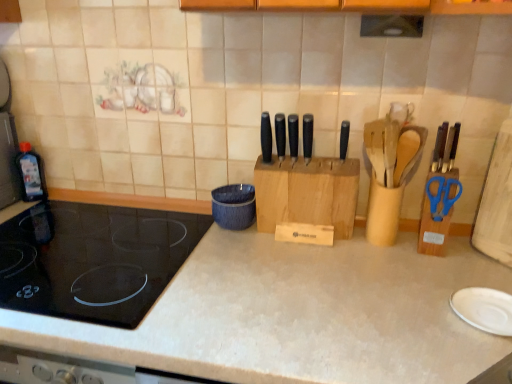
Locate an element on the screen. vacant point to the right of black matte knife at center, arranged as the first knife when viewed from the left is located at coordinates (318, 158).